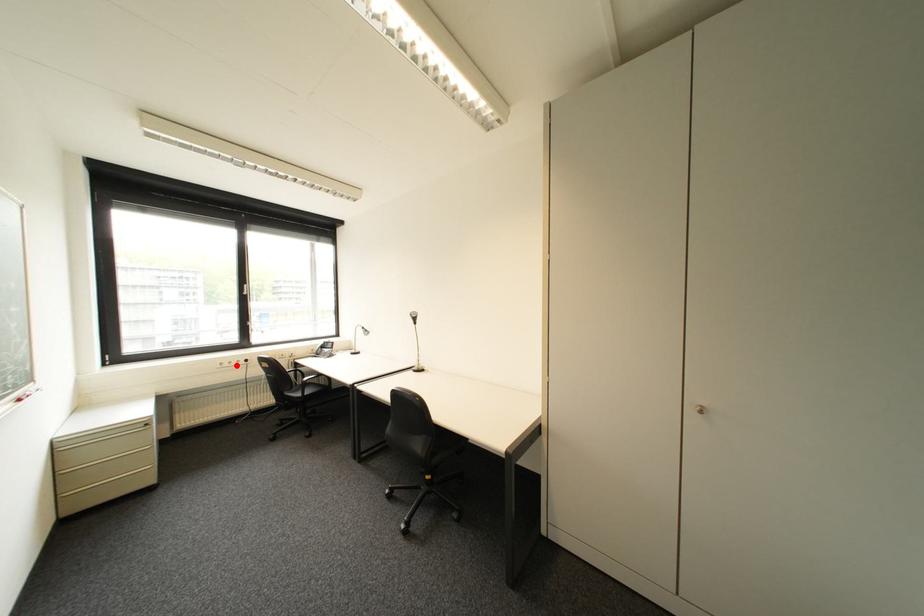
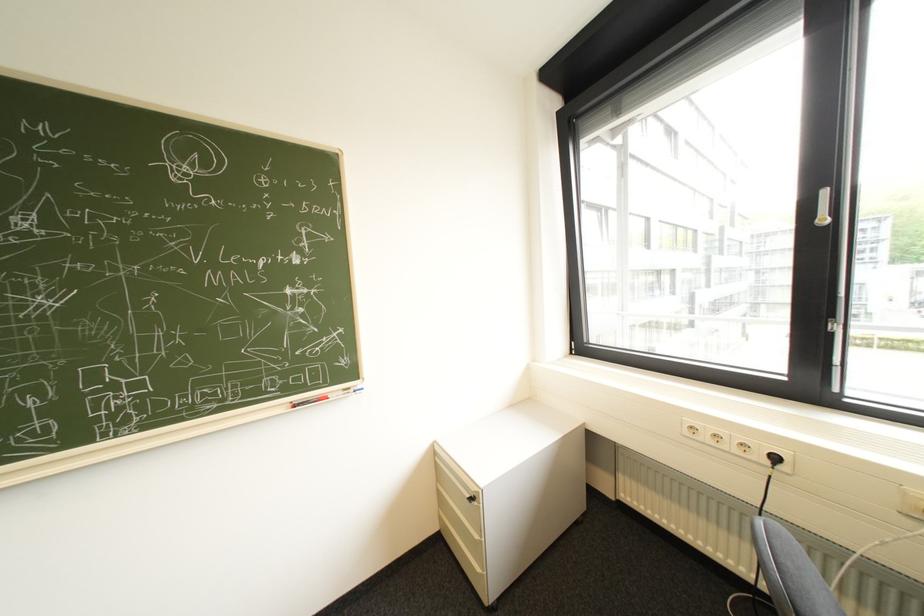
The point at the highlighted location is marked in the first image. Where is the corresponding point in the second image?

(715, 438)